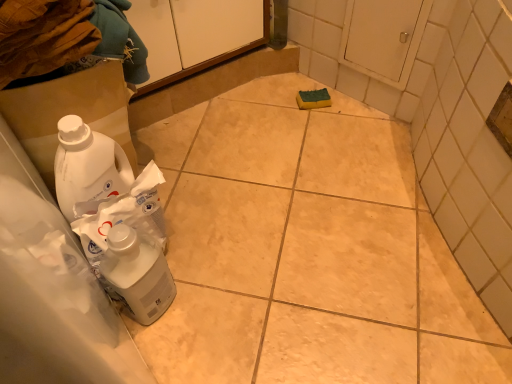
Question: Is point (240, 26) positioned closer to the camera than point (162, 286)?

Choices:
 (A) closer
 (B) farther

Answer: (B)

Question: In terms of size, does white matte cabinet at upper center appear bigger or smaller than white glossy plastic bottle at lower left?

Choices:
 (A) small
 (B) big

Answer: (B)

Question: Considering the real-world distances, which object is closest to the white cardboard box at lower left?

Choices:
 (A) white matte cabinet at upper center
 (B) white glossy plastic bottle at lower left

Answer: (B)

Question: Estimate the real-world distances between objects in this image. Which object is closer to the white matte cabinet at upper center?

Choices:
 (A) white glossy plastic bottle at lower left
 (B) white cardboard box at lower left

Answer: (B)